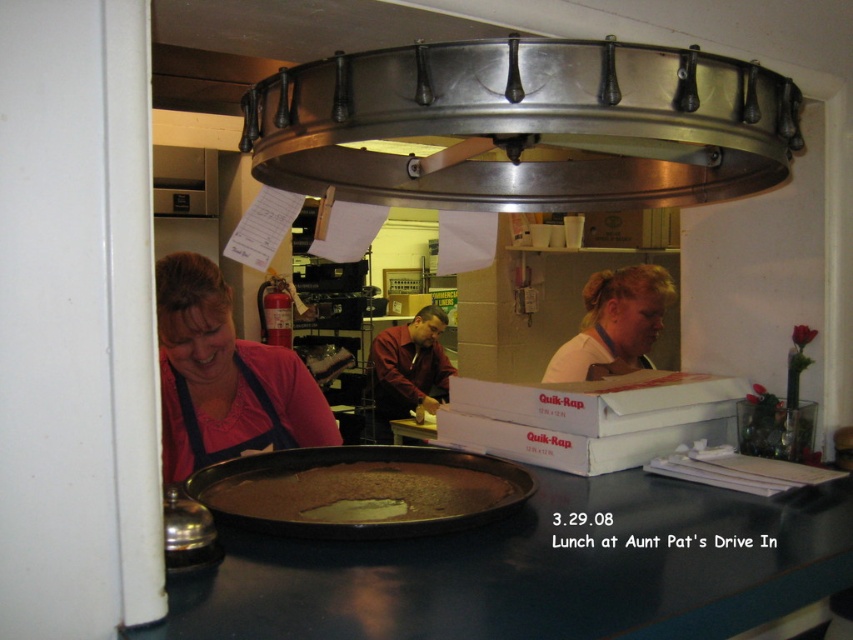
Does light beige shirt at center have a larger size compared to maroon shirt at center?

Yes, light beige shirt at center is bigger than maroon shirt at center.

Is light beige shirt at center closer to camera compared to maroon shirt at center?

Yes, it is in front of maroon shirt at center.

You are a GUI agent. You are given a task and a screenshot of the screen. Output one action in this format:
    pyautogui.click(x=<x>, y=<y>)
    Task: Click on the light beige shirt at center
    
    Given the screenshot: What is the action you would take?
    pyautogui.click(x=614, y=323)

In order to click on light beige shirt at center in this screenshot , I will do `click(614, 323)`.

Does black glossy counter top at center appear on the left side of brown matte pizza at center?

Incorrect, black glossy counter top at center is not on the left side of brown matte pizza at center.

Does black glossy counter top at center appear over brown matte pizza at center?

No.

Who is more distant from viewer, (x=447, y=570) or (x=517, y=492)?

The point (x=517, y=492) is behind.

I want to click on black glossy counter top at center, so click(534, 570).

Which is behind, point (496, 612) or point (215, 320)?

Point (215, 320)

Looking at this image, is black glossy counter top at center further to the viewer compared to matte pink shirt at lower left?

No, black glossy counter top at center is closer to the viewer.

Is point (834, 584) farther from viewer compared to point (337, 442)?

No, (834, 584) is in front of (337, 442).

You are a GUI agent. You are given a task and a screenshot of the screen. Output one action in this format:
    pyautogui.click(x=<x>, y=<y>)
    Task: Click on the black glossy counter top at center
    The width and height of the screenshot is (853, 640).
    Given the screenshot: What is the action you would take?
    pyautogui.click(x=534, y=570)